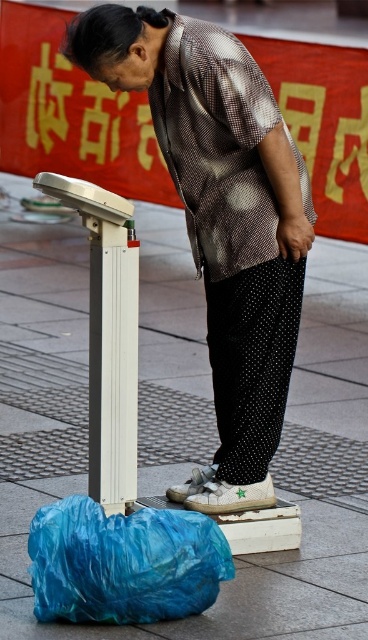
Consider the image. You are a delivery person trying to place a package on the ground near the white tile pavement at center and the metallic patterned shirt at center. Where should you place the package so it stays on the ground and doesn not get stepped on by the person?

The white tile pavement at center is located below metallic patterned shirt at center, so placing the package on the white tile pavement at center would keep it on the ground away from the person standing on it.

You are a photographer positioned at the center of the scene. You want to take a photo that includes both the point at point [288,560] and the point at point [90,435]. Which point should you focus on first to ensure both are in sharp focus?

Answer: You should focus on point [90,435] first because it is farther from the viewer, and focusing on the farther point ensures that both points will be in focus due to the depth of field.

You are a tailor trying to determine if the metallic patterned shirt at center can fit into the blue plastic bag at lower left. Based on their sizes, can the shirt be placed inside the bag?

The metallic patterned shirt at center has a larger width than the blue plastic bag at lower left, so the shirt cannot fit inside the bag.